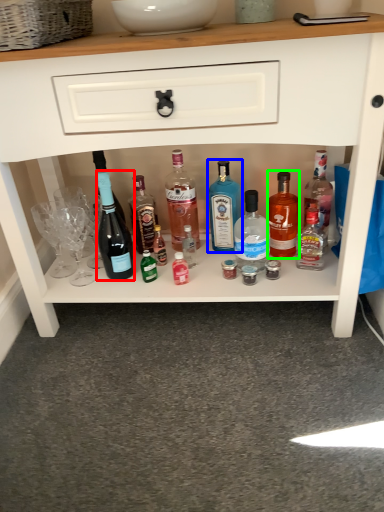
Question: Considering the real-world distances, which object is closest to bottle (highlighted by a red box)? bottle (highlighted by a blue box) or bottle (highlighted by a green box).

Choices:
 (A) bottle
 (B) bottle

Answer: (A)